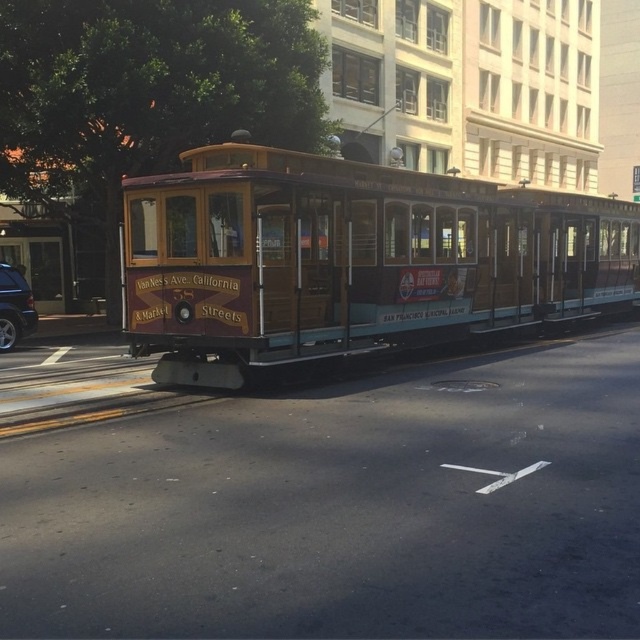
Question: Which point appears closest to the camera in this image?

Choices:
 (A) (305, 202)
 (B) (8, 323)

Answer: (A)

Question: Is the position of wooden cable car at center more distant than that of shiny black suv at left?

Choices:
 (A) no
 (B) yes

Answer: (A)

Question: Is wooden cable car at center wider than shiny black suv at left?

Choices:
 (A) no
 (B) yes

Answer: (B)

Question: Does wooden cable car at center have a larger size compared to shiny black suv at left?

Choices:
 (A) yes
 (B) no

Answer: (A)